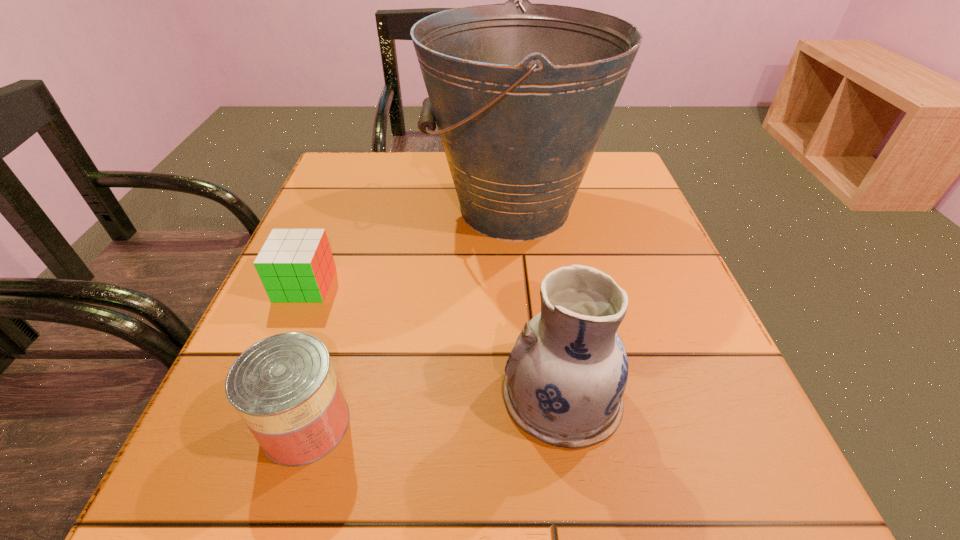
At what (x,y) coordinates should I click in order to perform the action: click on vacant area at the far edge of the desktop. Please return your answer as a coordinate pair (x, y). Image resolution: width=960 pixels, height=540 pixels. Looking at the image, I should click on (425, 158).

In the image, there is a desktop. Where is `vacant space at the near edge`? Image resolution: width=960 pixels, height=540 pixels. vacant space at the near edge is located at coordinates tap(650, 504).

In the image, there is a desktop. Where is `vacant space at the left edge`? This screenshot has width=960, height=540. vacant space at the left edge is located at coordinates (372, 226).

At what (x,y) coordinates should I click in order to perform the action: click on blank area at the right edge. Please return your answer as a coordinate pair (x, y). The width and height of the screenshot is (960, 540). Looking at the image, I should click on (636, 206).

I want to click on free spot at the far left corner of the desktop, so click(x=348, y=175).

I want to click on vacant point at the near right corner, so click(793, 519).

Identify the location of free point between the cube and the tallest object. The image size is (960, 540). (410, 246).

The height and width of the screenshot is (540, 960). I want to click on vacant space that's between the tallest object and the second tallest object, so tap(538, 302).

Where is `vacant area between the farthest object and the shortest object`? This screenshot has width=960, height=540. vacant area between the farthest object and the shortest object is located at coordinates (410, 246).

Find the location of a particular element. This screenshot has height=540, width=960. free space between the bucket and the can is located at coordinates (410, 316).